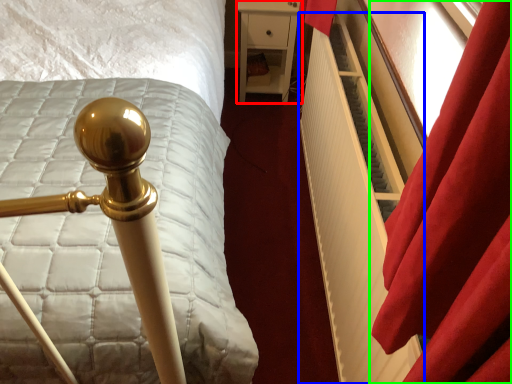
Question: Estimate the real-world distances between objects in this image. Which object is closer to furniture (highlighted by a red box), radiator (highlighted by a blue box) or curtain (highlighted by a green box)?

Choices:
 (A) radiator
 (B) curtain

Answer: (A)